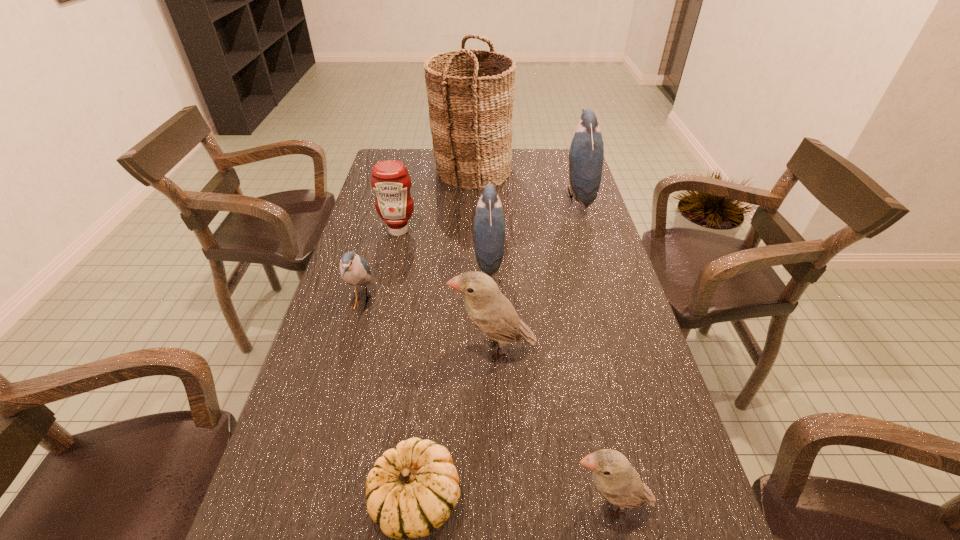
Where is `the smallest blue bird`? the smallest blue bird is located at coordinates (354, 269).

I want to click on the nearer white bird, so click(617, 481).

Locate an element on the screen. the nearest bird is located at coordinates (617, 481).

Locate an element on the screen. Image resolution: width=960 pixels, height=540 pixels. free space located 0.200m on the right of the tallest object is located at coordinates (563, 170).

Identify the location of vacant region located 0.400m at the tip of the tallest bird's beak. This screenshot has height=540, width=960. (450, 197).

At what (x,y) coordinates should I click in order to perform the action: click on free spot located at the tip of the tallest bird's beak. Please return your answer as a coordinate pair (x, y). Looking at the image, I should click on (479, 197).

Identify the location of vacant space located at the tip of the tallest bird's beak. Image resolution: width=960 pixels, height=540 pixels. (517, 197).

Where is `vacant space positioned 0.210m at the tip of the second blue bird from left to right's beak`? This screenshot has height=540, width=960. vacant space positioned 0.210m at the tip of the second blue bird from left to right's beak is located at coordinates (403, 262).

You are a GUI agent. You are given a task and a screenshot of the screen. Output one action in this format:
    pyautogui.click(x=<x>, y=<y>)
    Task: Click on the vacant area situated at the tip of the second blue bird from left to right's beak
    
    Given the screenshot: What is the action you would take?
    pyautogui.click(x=454, y=262)

The height and width of the screenshot is (540, 960). Identify the location of vacant space located 0.170m at the tip of the second blue bird from left to right's beak. (417, 262).